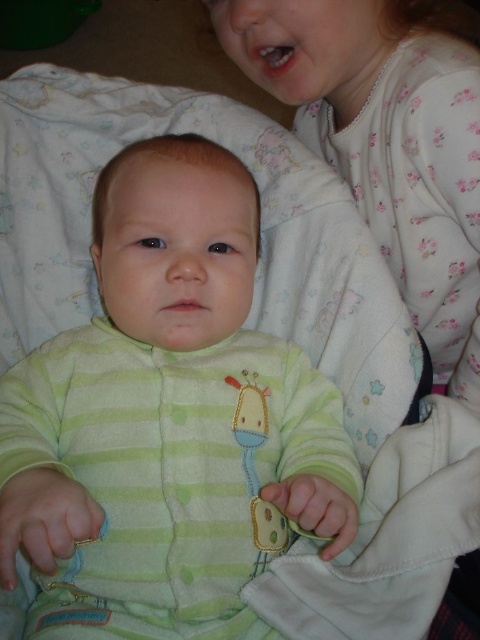
Does green striped onesie at center appear over white floral pajamas at upper right?

Actually, green striped onesie at center is below white floral pajamas at upper right.

What do you see at coordinates (168, 420) in the screenshot? I see `green striped onesie at center` at bounding box center [168, 420].

Locate an element on the screen. green striped onesie at center is located at coordinates (168, 420).